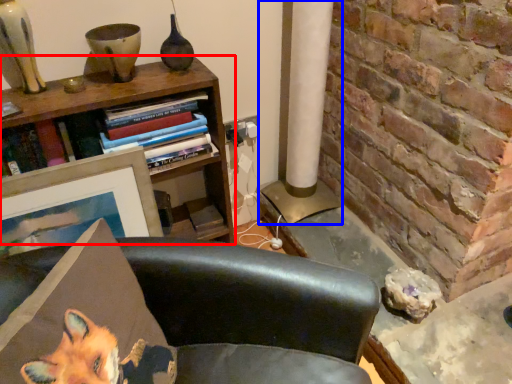
Question: Which object is closer to the camera taking this photo, bookcase (highlighted by a red box) or pillar (highlighted by a blue box)?

Choices:
 (A) bookcase
 (B) pillar

Answer: (A)